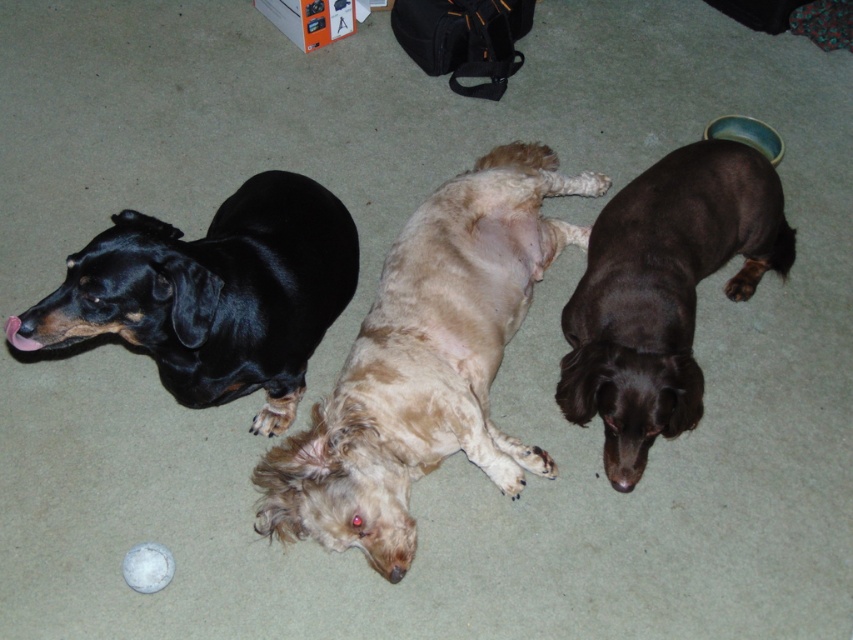
Question: Which of the following is the farthest from the observer?

Choices:
 (A) (639, 298)
 (B) (276, 433)
 (C) (364, 346)
 (D) (161, 566)

Answer: (B)

Question: Considering the real-world distances, which object is farthest from the light brown fur at center?

Choices:
 (A) shiny black dachshund at left
 (B) shiny black dog at right

Answer: (B)

Question: From the image, what is the correct spatial relationship of light brown fur at center in relation to white matte ball at lower center?

Choices:
 (A) below
 (B) above

Answer: (B)

Question: Can you confirm if light brown fur at center is positioned above shiny black dachshund at left?

Choices:
 (A) yes
 (B) no

Answer: (B)

Question: Is light brown fur at center wider than white matte ball at lower center?

Choices:
 (A) no
 (B) yes

Answer: (B)

Question: Based on their relative distances, which object is farther from the white matte ball at lower center?

Choices:
 (A) shiny black dachshund at left
 (B) shiny black dog at right
 (C) light brown fur at center

Answer: (B)